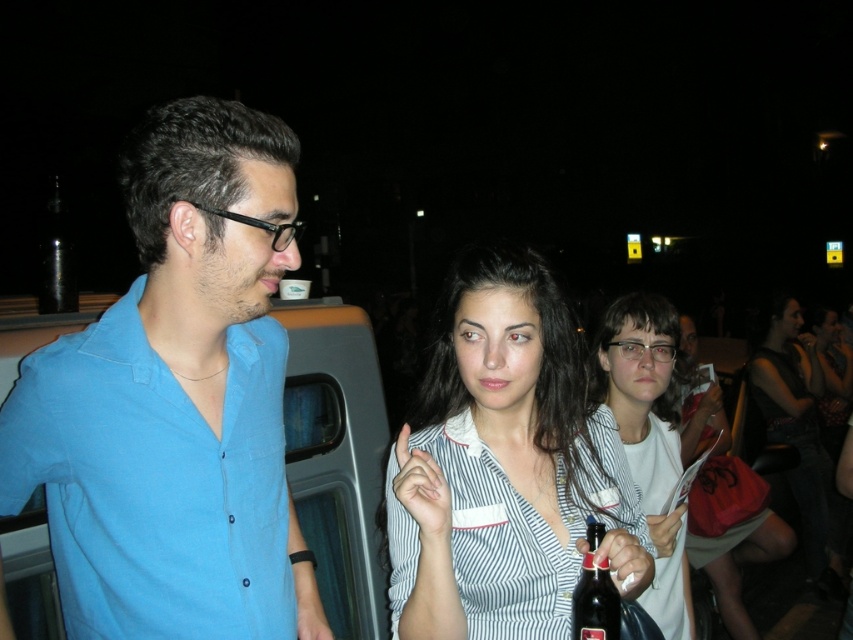
You are standing at the center of the scene. Which direction should you look to see the blue cotton shirt at left?

The blue cotton shirt at left is located at point 0.627 on the x and 0.208 on the y axis, so you should look to the left side of the scene to see it.

You are a photographer at this event and want to take a photo of both the blue cotton shirt at left and the white striped shirt at center. However, you need to ensure that both subjects are fully visible in the frame. Given their current positions, can you capture both individuals without any obstruction?

Yes, the blue cotton shirt at left is in front of the white striped shirt at center, so the photographer can position themselves to capture both subjects without obstruction as long as the front subject does not block the view of the back one. Since the blue cotton shirt is in front, adjusting the angle slightly should allow both to be visible.